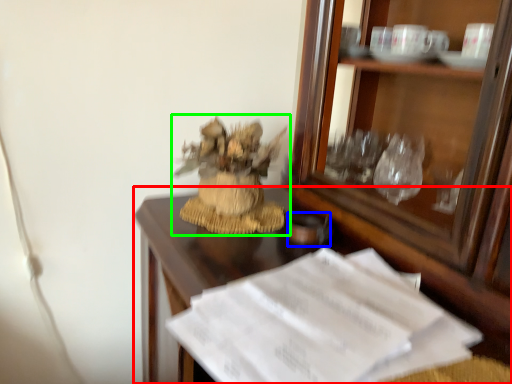
Question: Based on their relative distances, which object is nearer to desk (highlighted by a red box)? Choose from tableware (highlighted by a blue box) and houseplant (highlighted by a green box).

Choices:
 (A) tableware
 (B) houseplant

Answer: (B)